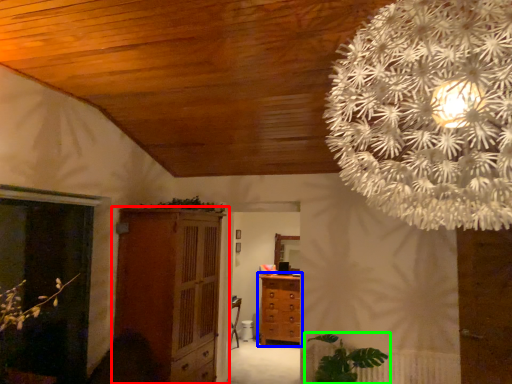
Question: Considering the real-world distances, which object is closest to cupboard (highlighted by a red box)? chest of drawers (highlighted by a blue box) or houseplant (highlighted by a green box).

Choices:
 (A) chest of drawers
 (B) houseplant

Answer: (B)